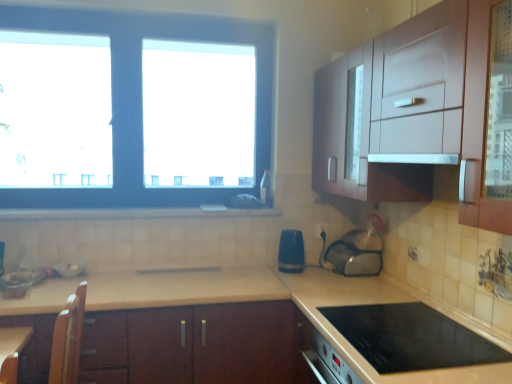
Question: From a real-world perspective, is white glossy exhaust hood at upper right physically below transparent plastic bag at center, marked as the 1th appliance in a right-to-left arrangement?

Choices:
 (A) no
 (B) yes

Answer: (A)

Question: From the image's perspective, is white glossy exhaust hood at upper right above transparent plastic bag at center, the third appliance from the left?

Choices:
 (A) no
 (B) yes

Answer: (B)

Question: Considering the relative sizes of white glossy exhaust hood at upper right and transparent plastic bag at center, marked as the 1th appliance in a right-to-left arrangement, in the image provided, is white glossy exhaust hood at upper right wider than transparent plastic bag at center, marked as the 1th appliance in a right-to-left arrangement,?

Choices:
 (A) yes
 (B) no

Answer: (A)

Question: Would you say white glossy exhaust hood at upper right contains transparent plastic bag at center, marked as the 1th appliance in a right-to-left arrangement?

Choices:
 (A) no
 (B) yes

Answer: (A)

Question: Is white glossy exhaust hood at upper right positioned with its back to transparent plastic bag at center, the third appliance from the left?

Choices:
 (A) no
 (B) yes

Answer: (A)

Question: Looking at the image, does white glossy exhaust hood at upper right seem bigger or smaller compared to blue matte window at upper left?

Choices:
 (A) small
 (B) big

Answer: (A)

Question: Does point (436, 157) appear closer or farther from the camera than point (260, 29)?

Choices:
 (A) closer
 (B) farther

Answer: (A)

Question: Do you think white glossy exhaust hood at upper right is within blue matte window at upper left, or outside of it?

Choices:
 (A) outside
 (B) inside

Answer: (A)

Question: Based on their positions, is white glossy exhaust hood at upper right located to the left or right of blue matte window at upper left?

Choices:
 (A) left
 (B) right

Answer: (B)

Question: Considering the relative positions of metallic silver bowl at lower left, which ranks as the 1th appliance in left-to-right order, and transparent plastic bag at center, the third appliance from the left, in the image provided, is metallic silver bowl at lower left, which ranks as the 1th appliance in left-to-right order, to the left or to the right of transparent plastic bag at center, the third appliance from the left,?

Choices:
 (A) left
 (B) right

Answer: (A)

Question: Would you say metallic silver bowl at lower left, which is the third appliance from right to left, is inside or outside transparent plastic bag at center, the third appliance from the left?

Choices:
 (A) outside
 (B) inside

Answer: (A)

Question: From the image's perspective, is metallic silver bowl at lower left, which ranks as the 1th appliance in left-to-right order, located above or below transparent plastic bag at center, the third appliance from the left?

Choices:
 (A) above
 (B) below

Answer: (B)

Question: From a real-world perspective, is metallic silver bowl at lower left, which is the third appliance from right to left, positioned above or below transparent plastic bag at center, marked as the 1th appliance in a right-to-left arrangement?

Choices:
 (A) below
 (B) above

Answer: (A)

Question: Is point (314, 235) positioned closer to the camera than point (300, 236)?

Choices:
 (A) farther
 (B) closer

Answer: (A)

Question: Considering the positions of black plastic electric outlet at center and blue plastic toaster at center, marked as the second appliance in a left-to-right arrangement, in the image, is black plastic electric outlet at center bigger or smaller than blue plastic toaster at center, marked as the second appliance in a left-to-right arrangement,?

Choices:
 (A) big
 (B) small

Answer: (B)